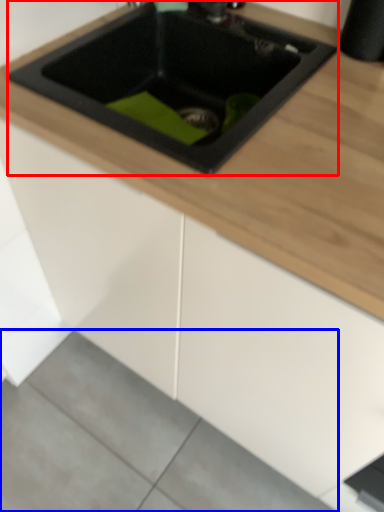
Question: Which object is closer to the camera taking this photo, sink (highlighted by a red box) or concrete (highlighted by a blue box)?

Choices:
 (A) sink
 (B) concrete

Answer: (A)